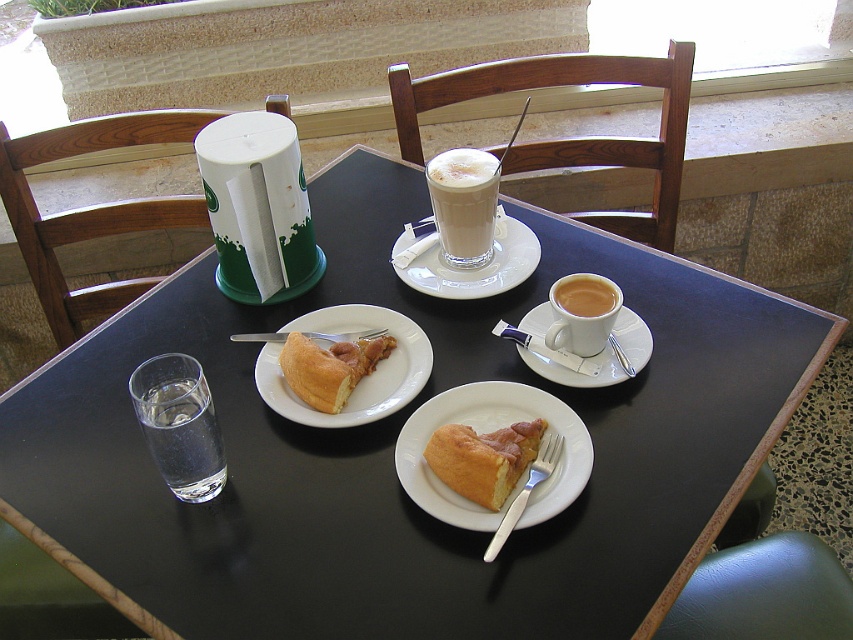
You are a food stylist arranging a photo shoot. You have a white matte plate at center and a golden flaky pastry at center on the table. Which object is taller?

The white matte plate at center is much taller than the golden flaky pastry at center.